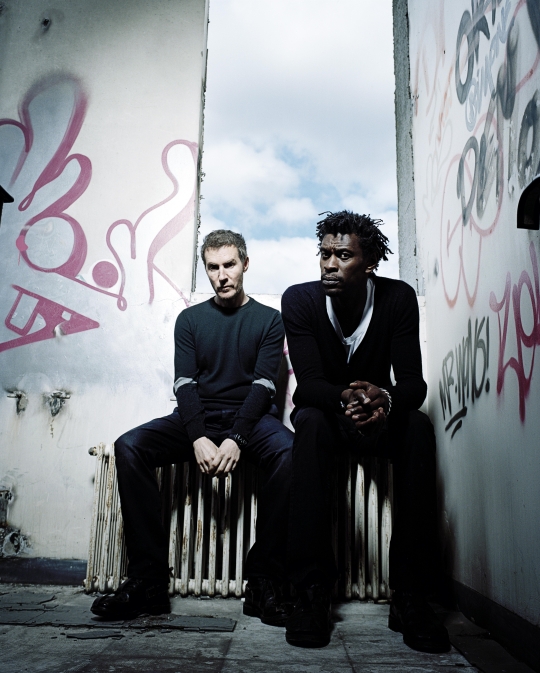
The height and width of the screenshot is (673, 540). Find the location of `walls`. walls is located at coordinates (483, 221), (97, 217).